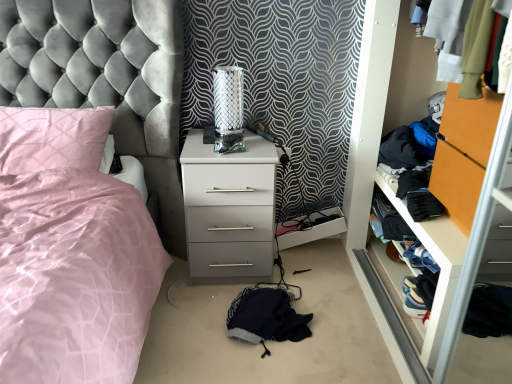
Where is `vacant space that's between denim fabric clothes at right and fuzzy dark blue blanket at lower center, which is the 3th clothing from top to bottom`? vacant space that's between denim fabric clothes at right and fuzzy dark blue blanket at lower center, which is the 3th clothing from top to bottom is located at coordinates (343, 309).